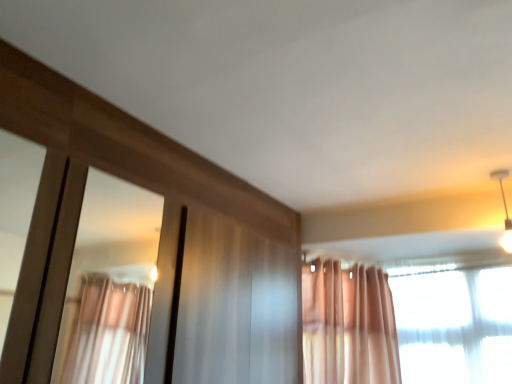
Question: Is translucent fabric curtain at upper right taller or shorter than white glossy light fixture at upper right?

Choices:
 (A) short
 (B) tall

Answer: (B)

Question: From a real-world perspective, is translucent fabric curtain at upper right above or below white glossy light fixture at upper right?

Choices:
 (A) above
 (B) below

Answer: (B)

Question: Is translucent fabric curtain at upper right to the left or to the right of white glossy light fixture at upper right in the image?

Choices:
 (A) right
 (B) left

Answer: (B)

Question: Is white glossy light fixture at upper right inside the boundaries of translucent fabric curtain at upper right, or outside?

Choices:
 (A) inside
 (B) outside

Answer: (B)

Question: From their relative heights in the image, would you say white glossy light fixture at upper right is taller or shorter than translucent fabric curtain at upper right?

Choices:
 (A) tall
 (B) short

Answer: (B)

Question: From the image's perspective, is white glossy light fixture at upper right positioned above or below translucent fabric curtain at upper right?

Choices:
 (A) above
 (B) below

Answer: (A)

Question: Considering the positions of point (505, 220) and point (497, 296), is point (505, 220) closer or farther from the camera than point (497, 296)?

Choices:
 (A) closer
 (B) farther

Answer: (A)